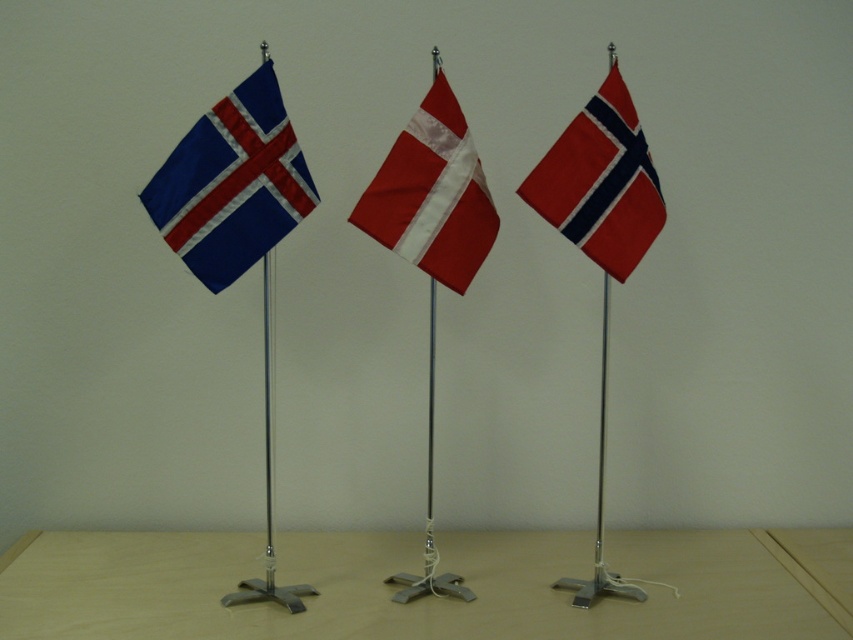
You are standing in front of the three miniature flags displayed on small flagpoles. You notice two points marked on the image. Which point is closer to you, point (x=19, y=570) or point (x=289, y=134)?

Point (x=19, y=570) is closer to you than point (x=289, y=134) because it is further to the viewer.

You are a museum curator arranging flags in a display case. The matte fabric flag at left and the white glossy flag at center are part of the exhibit. If the display case is only 7 inches wide, will both flags fit side by side without overlapping?

The matte fabric flag at left is 6.93 inches from the white glossy flag at center, which means there is only a 0.07 inch gap between them. Since the display case is 7 inches wide, both flags can just barely fit side by side without overlapping, but they will be extremely close together.

Consider the image. You are standing in a room with a wooden table at center. You want to place a small decorative item on the table. Where should you aim to place it so it stays centered?

You should aim to place the small decorative item at the point corresponding to the coordinates of the wooden table at center, which is at point (x=426, y=596), to ensure it stays centered.